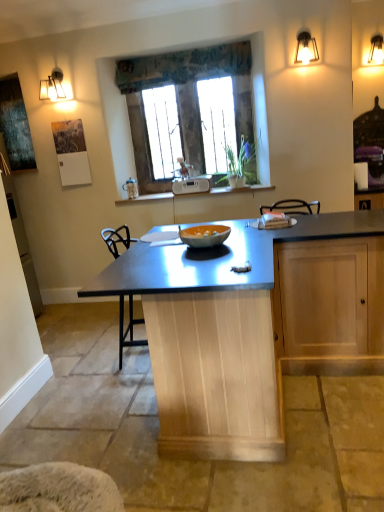
The width and height of the screenshot is (384, 512). Identify the location of vacant region in front of orange matte glass bowl at center. (211, 259).